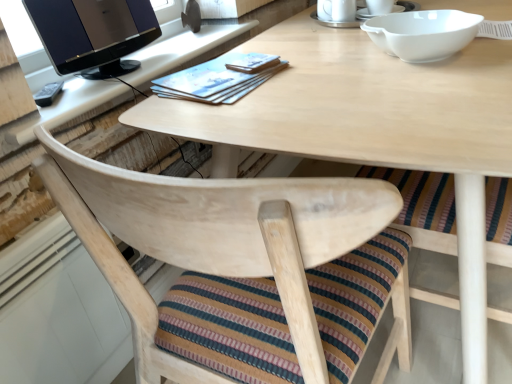
Question: Which direction should I rotate to look at white ceramic saucer at upper center, which is the 2th saucer from right to left, — up or down?

Choices:
 (A) down
 (B) up

Answer: (B)

Question: From the image's perspective, is satin black monitor at upper left on top of white ceramic saucer at upper center, the 1th saucer viewed from the left?

Choices:
 (A) yes
 (B) no

Answer: (B)

Question: From a real-world perspective, is satin black monitor at upper left on top of white ceramic saucer at upper center, the 1th saucer viewed from the left?

Choices:
 (A) no
 (B) yes

Answer: (B)

Question: Does satin black monitor at upper left come in front of white ceramic saucer at upper center, the 1th saucer viewed from the left?

Choices:
 (A) no
 (B) yes

Answer: (B)

Question: Is satin black monitor at upper left facing away from white ceramic saucer at upper center, the 1th saucer viewed from the left?

Choices:
 (A) no
 (B) yes

Answer: (A)

Question: Does satin black monitor at upper left have a greater height compared to white ceramic saucer at upper center, which is the 2th saucer from right to left?

Choices:
 (A) yes
 (B) no

Answer: (A)

Question: From the image's perspective, would you say satin black monitor at upper left is shown under white ceramic saucer at upper center, which is the 2th saucer from right to left?

Choices:
 (A) yes
 (B) no

Answer: (A)

Question: Considering the relative sizes of white ceramic saucer at upper center, which is the 2th saucer from right to left, and white ceramic saucer at upper center, placed as the 2th saucer when sorted from left to right, in the image provided, is white ceramic saucer at upper center, which is the 2th saucer from right to left, bigger than white ceramic saucer at upper center, placed as the 2th saucer when sorted from left to right,?

Choices:
 (A) yes
 (B) no

Answer: (A)

Question: Would you say white ceramic saucer at upper center, the 1th saucer viewed from the left, is a long distance from white ceramic saucer at upper center, positioned as the first saucer in right-to-left order?

Choices:
 (A) no
 (B) yes

Answer: (A)

Question: Is white ceramic saucer at upper center, which is the 2th saucer from right to left, oriented towards white ceramic saucer at upper center, placed as the 2th saucer when sorted from left to right?

Choices:
 (A) yes
 (B) no

Answer: (B)

Question: Is white ceramic saucer at upper center, the 1th saucer viewed from the left, wider than white ceramic saucer at upper center, placed as the 2th saucer when sorted from left to right?

Choices:
 (A) yes
 (B) no

Answer: (A)

Question: Does white ceramic saucer at upper center, which is the 2th saucer from right to left, have a lesser width compared to white ceramic saucer at upper center, positioned as the first saucer in right-to-left order?

Choices:
 (A) no
 (B) yes

Answer: (A)

Question: Would you say white ceramic saucer at upper center, the 1th saucer viewed from the left, is outside white ceramic saucer at upper center, positioned as the first saucer in right-to-left order?

Choices:
 (A) yes
 (B) no

Answer: (A)

Question: Is satin black monitor at upper left positioned before white ceramic mug at upper center?

Choices:
 (A) no
 (B) yes

Answer: (B)